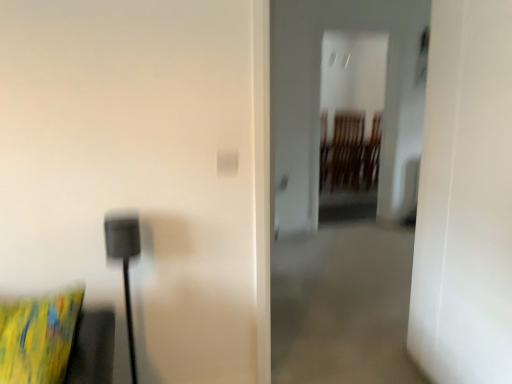
Question: From a real-world perspective, is transparent glass door at center located beneath yellow fabric pillow at lower left?

Choices:
 (A) no
 (B) yes

Answer: (A)

Question: Is transparent glass door at center bigger than yellow fabric pillow at lower left?

Choices:
 (A) yes
 (B) no

Answer: (A)

Question: Can you confirm if transparent glass door at center is thinner than yellow fabric pillow at lower left?

Choices:
 (A) yes
 (B) no

Answer: (A)

Question: Considering the relative sizes of transparent glass door at center and yellow fabric pillow at lower left in the image provided, is transparent glass door at center wider than yellow fabric pillow at lower left?

Choices:
 (A) no
 (B) yes

Answer: (A)

Question: Is transparent glass door at center oriented away from yellow fabric pillow at lower left?

Choices:
 (A) no
 (B) yes

Answer: (A)

Question: Does transparent glass door at center appear on the left side of yellow fabric pillow at lower left?

Choices:
 (A) no
 (B) yes

Answer: (A)

Question: From a real-world perspective, is yellow fabric pillow at lower left located higher than transparent glass door at center?

Choices:
 (A) no
 (B) yes

Answer: (A)

Question: Does yellow fabric pillow at lower left come in front of transparent glass door at center?

Choices:
 (A) yes
 (B) no

Answer: (A)

Question: Is the surface of yellow fabric pillow at lower left in direct contact with transparent glass door at center?

Choices:
 (A) yes
 (B) no

Answer: (B)

Question: Is yellow fabric pillow at lower left to the right of transparent glass door at center from the viewer's perspective?

Choices:
 (A) no
 (B) yes

Answer: (A)

Question: Does yellow fabric pillow at lower left have a lesser width compared to transparent glass door at center?

Choices:
 (A) no
 (B) yes

Answer: (A)

Question: Could you tell me if yellow fabric pillow at lower left is facing transparent glass door at center?

Choices:
 (A) yes
 (B) no

Answer: (B)

Question: Visually, is yellow fabric pillow at lower left positioned to the left or to the right of transparent glass door at center?

Choices:
 (A) left
 (B) right

Answer: (A)